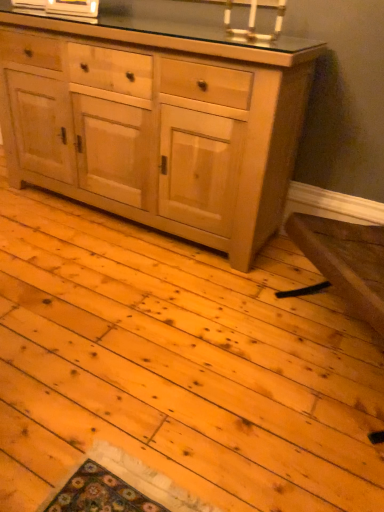
Question: Can you confirm if natural wood cabinet at center is taller than white ceramic candle holder at upper center?

Choices:
 (A) yes
 (B) no

Answer: (A)

Question: From the image's perspective, is natural wood cabinet at center over white ceramic candle holder at upper center?

Choices:
 (A) no
 (B) yes

Answer: (A)

Question: Is natural wood cabinet at center shorter than white ceramic candle holder at upper center?

Choices:
 (A) yes
 (B) no

Answer: (B)

Question: Is natural wood cabinet at center not near white ceramic candle holder at upper center?

Choices:
 (A) yes
 (B) no

Answer: (B)

Question: Is the position of natural wood cabinet at center less distant than that of white ceramic candle holder at upper center?

Choices:
 (A) yes
 (B) no

Answer: (A)

Question: From a real-world perspective, is natural wood cabinet at center over white ceramic candle holder at upper center?

Choices:
 (A) no
 (B) yes

Answer: (A)

Question: From a real-world perspective, is white ceramic candle holder at upper center on natural wood cabinet at center?

Choices:
 (A) yes
 (B) no

Answer: (A)

Question: Is white ceramic candle holder at upper center wider than natural wood cabinet at center?

Choices:
 (A) yes
 (B) no

Answer: (B)

Question: Would you say white ceramic candle holder at upper center is outside natural wood cabinet at center?

Choices:
 (A) no
 (B) yes

Answer: (B)

Question: Is white ceramic candle holder at upper center positioned before natural wood cabinet at center?

Choices:
 (A) yes
 (B) no

Answer: (B)

Question: Does white ceramic candle holder at upper center have a lesser width compared to natural wood cabinet at center?

Choices:
 (A) no
 (B) yes

Answer: (B)

Question: From the image's perspective, is white ceramic candle holder at upper center on top of natural wood cabinet at center?

Choices:
 (A) no
 (B) yes

Answer: (B)

Question: From their relative heights in the image, would you say natural wood cabinet at center is taller or shorter than white ceramic candle holder at upper center?

Choices:
 (A) short
 (B) tall

Answer: (B)